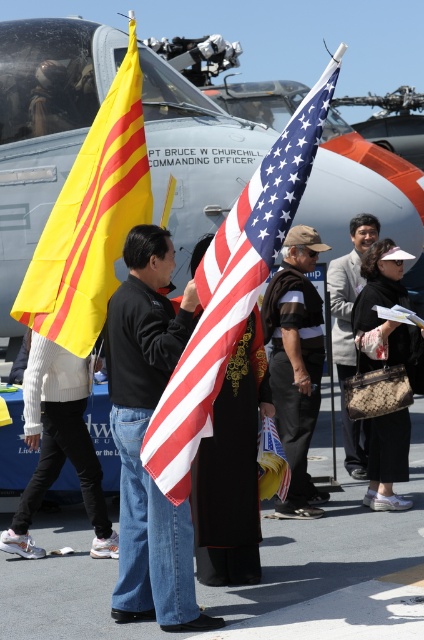
You are standing at the origin point in the scene. Where is the denim jeans at center located in terms of coordinates?

The denim jeans at center is located at point (144, 435).

You are at an outdoor event with an aircraft named after PT BRUCE W CHURCHILL COMMANDING OFFICER in the background. You see a point marked at coordinates (233,289). What object is located at that point?

The point at coordinates (233,289) corresponds to the American flag at center.

You are a photographer at the event and want to capture a photo that includes both the yellow flag with red stripes and the American flag. Given their positions at point (x=159, y=609) and point (x=296, y=122) respectively, which flag should you focus on first to ensure both are in clear view?

You should focus on the yellow flag with red stripes at point (x=159, y=609) first because it is closer to the camera than the American flag at point (x=296, y=122). This ensures both flags will be in focus as the American flag is further away.